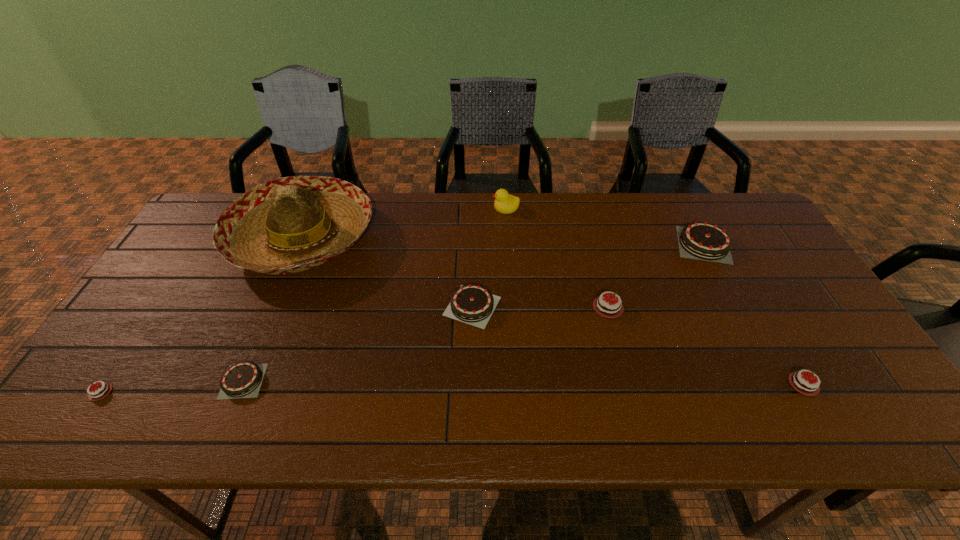
The width and height of the screenshot is (960, 540). Find the location of `blank space at the far right corner`. blank space at the far right corner is located at coordinates (749, 225).

The height and width of the screenshot is (540, 960). I want to click on vacant space that is in between the leftmost brown chocolate cake and the red sombrero, so click(273, 309).

Locate an element on the screen. The image size is (960, 540). free spot between the farthest red chocolate cake and the shortest chocolate cake is located at coordinates (354, 349).

The height and width of the screenshot is (540, 960). I want to click on vacant area that lies between the fifth chocolate cake from right to left and the fourth chocolate cake from right to left, so click(x=357, y=343).

Find the location of `unoccupied area between the shortest chocolate cake and the tallest chocolate cake`. unoccupied area between the shortest chocolate cake and the tallest chocolate cake is located at coordinates (402, 318).

The width and height of the screenshot is (960, 540). What are the coordinates of `vacant space in between the sixth object from left to right and the red sombrero` in the screenshot? It's located at (455, 272).

Find the location of a particular element. This screenshot has height=540, width=960. free space between the yellow duckling and the red sombrero is located at coordinates (404, 222).

You are a GUI agent. You are given a task and a screenshot of the screen. Output one action in this format:
    pyautogui.click(x=<x>, y=<y>)
    Task: Click on the free spot between the rightmost red chocolate cake and the third object from right to left
    The height and width of the screenshot is (540, 960).
    Given the screenshot: What is the action you would take?
    pyautogui.click(x=706, y=346)

The height and width of the screenshot is (540, 960). What are the coordinates of `unoccupied area between the second biggest red chocolate cake and the yellow duckling` in the screenshot? It's located at (655, 295).

Where is `free space between the tallest chocolate cake and the shortest object`? The height and width of the screenshot is (540, 960). free space between the tallest chocolate cake and the shortest object is located at coordinates (402, 318).